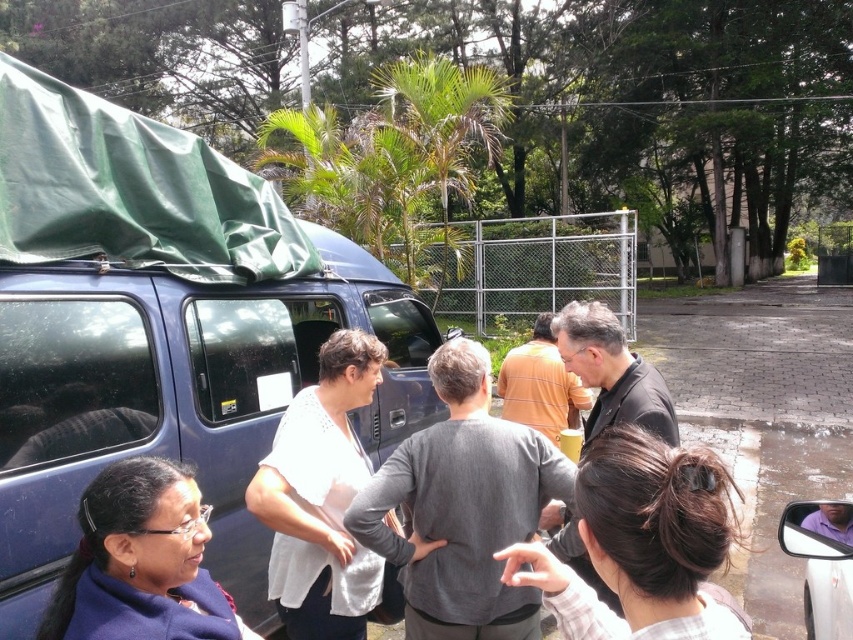
Does white textured shirt at center have a smaller size compared to dark brown hair bun at center?

Incorrect, white textured shirt at center is not smaller in size than dark brown hair bun at center.

At what (x,y) coordinates should I click in order to perform the action: click on white textured shirt at center. Please return your answer as a coordinate pair (x, y). Looking at the image, I should click on 321,497.

Who is positioned more to the right, matte blue minivan at center or dark brown hair bun at center?

dark brown hair bun at center is more to the right.

Who is more distant from viewer, (x=216, y=426) or (x=529, y=548)?

Point (x=216, y=426)

Locate an element on the screen. This screenshot has width=853, height=640. matte blue minivan at center is located at coordinates point(178,397).

Is point (213, 452) farther from viewer compared to point (219, 604)?

That is True.

Which is above, matte blue minivan at center or blue fabric jacket at lower left?

matte blue minivan at center is above.

Between point (9, 557) and point (239, 620), which one is positioned behind?

Positioned behind is point (9, 557).

I want to click on matte blue minivan at center, so click(x=178, y=397).